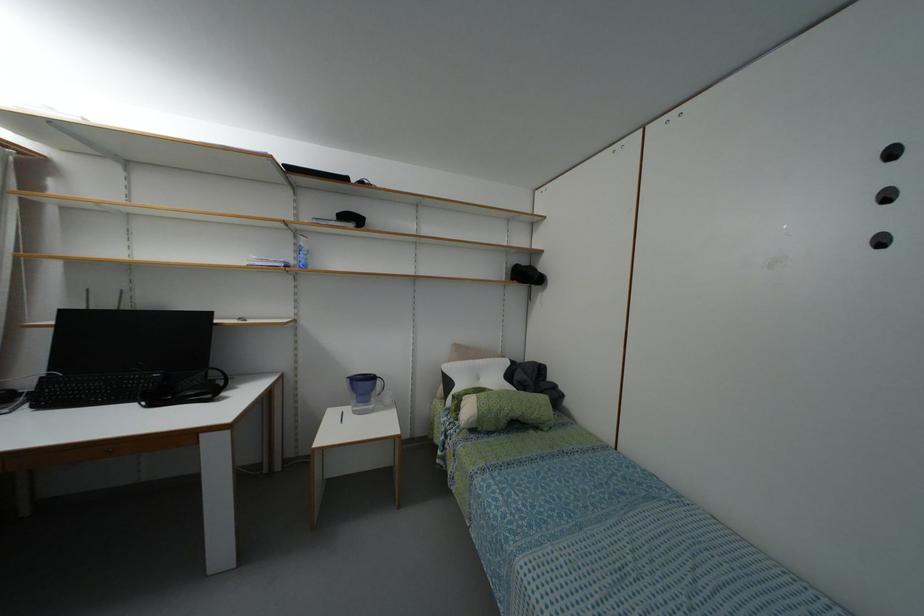
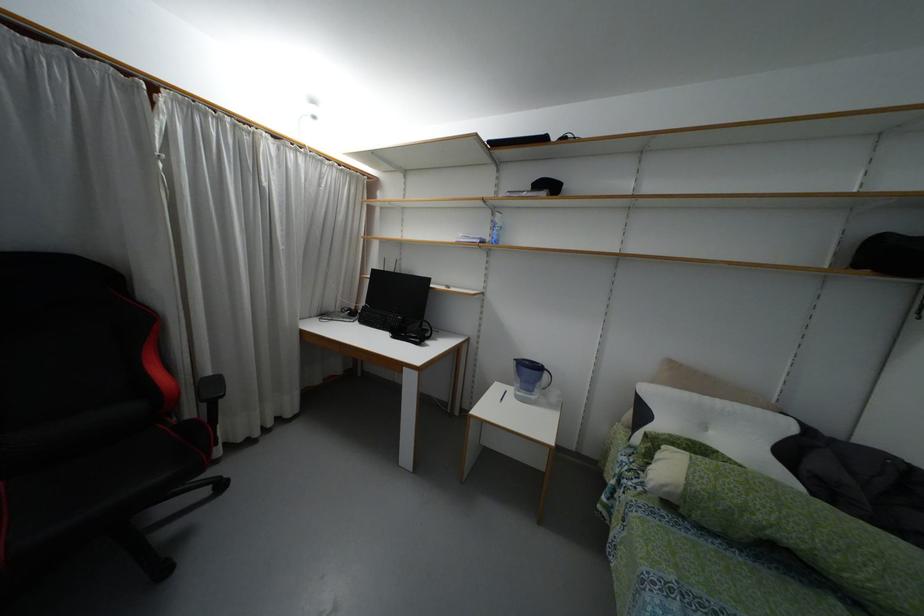
In the second image, find the point that corresponds to (x=296, y=233) in the first image.

(493, 209)